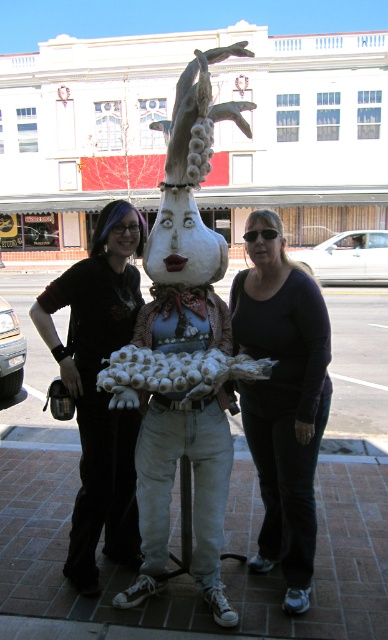
You are a photographer trying to capture a candid shot of the matte black shirt at center and the black matte pants at lower center. Since you want to ensure both are in the frame, where should you position yourself relative to the two objects?

You should position yourself to the left of both the matte black shirt at center and the black matte pants at lower center so that both are visible in the frame. The black matte pants at lower center are to the right of the matte black shirt at center, so positioning yourself to the left would allow you to capture both in the shot.